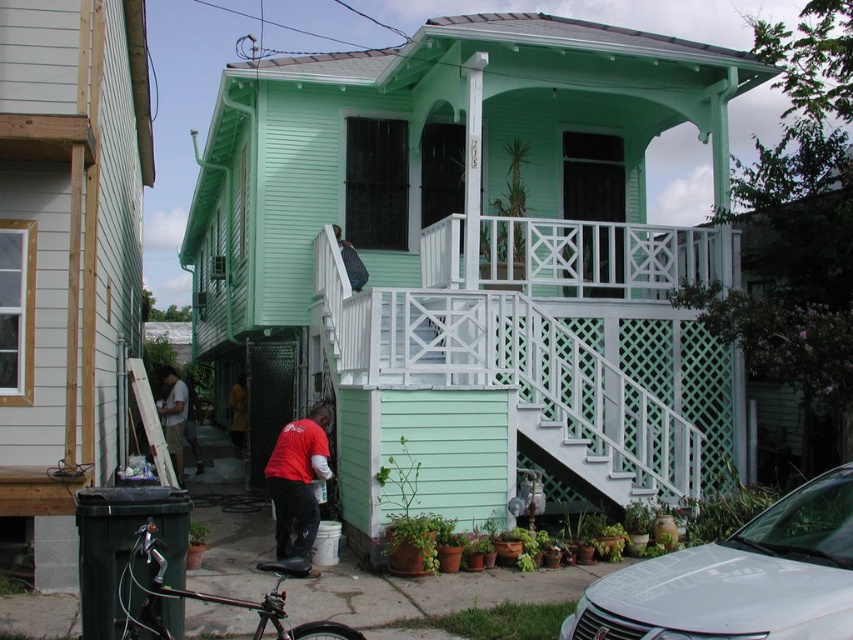
Question: Which of the following is the farthest from the observer?

Choices:
 (A) (601, 227)
 (B) (281, 499)
 (C) (579, 476)

Answer: (A)

Question: Considering the relative positions of white lattice stairs at center and matte black backpack at upper center in the image provided, where is white lattice stairs at center located with respect to matte black backpack at upper center?

Choices:
 (A) left
 (B) right

Answer: (B)

Question: Is red cotton shirt at lower center above red shirt at center?

Choices:
 (A) no
 (B) yes

Answer: (A)

Question: Which object is farther from the camera taking this photo?

Choices:
 (A) red shirt at center
 (B) white glossy sedan at lower right
 (C) white lattice stairs at center
 (D) red cotton shirt at lower center

Answer: (A)

Question: Is shiny black bicycle at lower left to the right of matte black backpack at upper center from the viewer's perspective?

Choices:
 (A) yes
 (B) no

Answer: (B)

Question: Among these points, which one is nearest to the camera?

Choices:
 (A) (165, 394)
 (B) (576, 458)
 (C) (349, 275)
 (D) (521, 296)

Answer: (B)